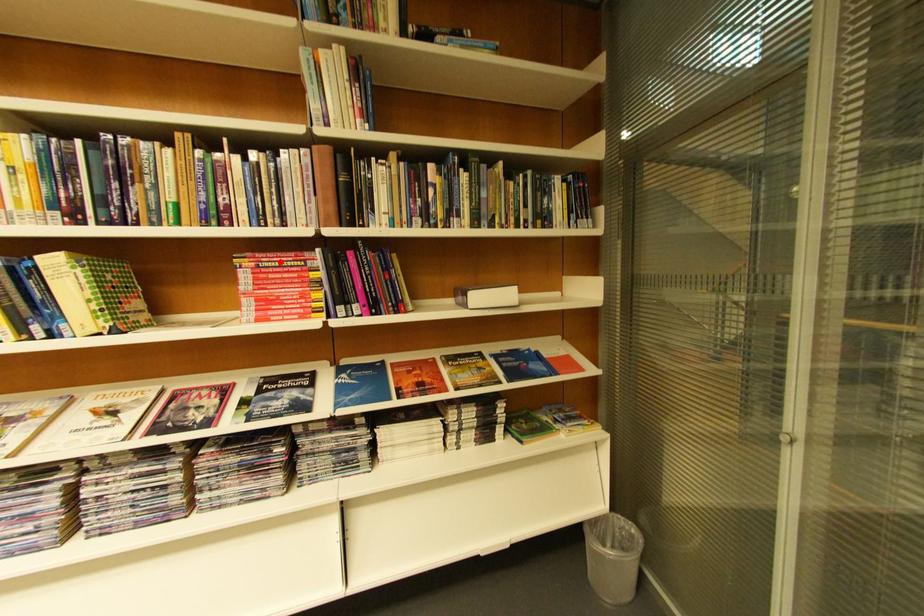
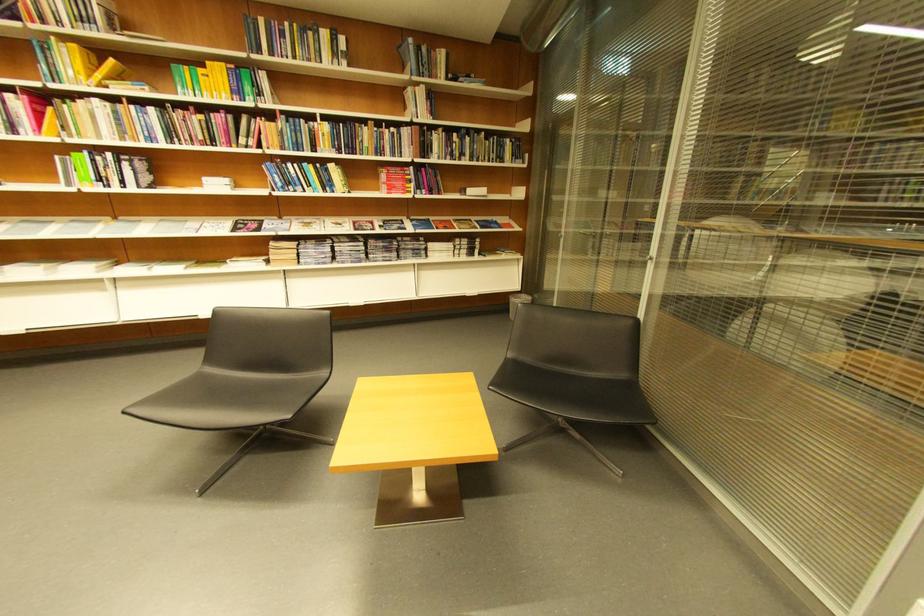
Question: I am providing you with two images of the same scene from different viewpoints. In image1, a red point is highlighted. Considering the same 3D point in image2, which of the following is correct?

Choices:
 (A) It is closer
 (B) It is farther

Answer: (A)